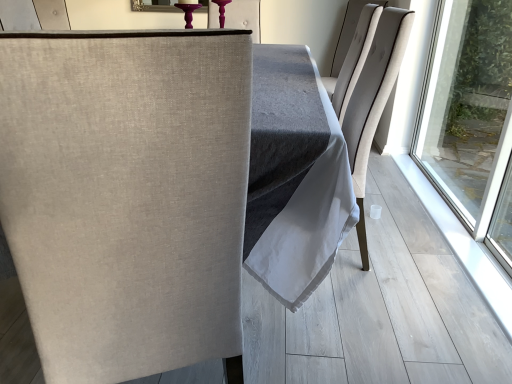
Question: Can you confirm if beige fabric chair at left, the second chair viewed from the top, is positioned to the right of light beige fabric chair at upper right, placed as the second chair when sorted from front to back?

Choices:
 (A) yes
 (B) no

Answer: (B)

Question: From a real-world perspective, is beige fabric chair at left, acting as the second chair starting from the back, beneath light beige fabric chair at upper right, the first chair positioned from the back?

Choices:
 (A) no
 (B) yes

Answer: (B)

Question: Is there a large distance between beige fabric chair at left, arranged as the first chair when ordered from the bottom, and light beige fabric chair at upper right, the first chair positioned from the back?

Choices:
 (A) yes
 (B) no

Answer: (A)

Question: Is beige fabric chair at left, positioned as the first chair in left-to-right order, closer to camera compared to light beige fabric chair at upper right, the first chair positioned from the back?

Choices:
 (A) no
 (B) yes

Answer: (B)

Question: Does beige fabric chair at left, arranged as the first chair when ordered from the bottom, have a lesser width compared to light beige fabric chair at upper right, which ranks as the second chair in left-to-right order?

Choices:
 (A) no
 (B) yes

Answer: (A)

Question: Considering the relative sizes of beige fabric chair at left, positioned as the 2th chair in right-to-left order, and light beige fabric chair at upper right, which appears as the first chair when viewed from the top, in the image provided, is beige fabric chair at left, positioned as the 2th chair in right-to-left order, taller than light beige fabric chair at upper right, which appears as the first chair when viewed from the top,?

Choices:
 (A) no
 (B) yes

Answer: (B)

Question: Can you confirm if light beige fabric chair at upper right, acting as the first chair starting from the right, is shorter than beige fabric chair at left, acting as the second chair starting from the back?

Choices:
 (A) yes
 (B) no

Answer: (A)

Question: Is light beige fabric chair at upper right, which appears as the first chair when viewed from the top, turned away from beige fabric chair at left, arranged as the first chair when ordered from the bottom?

Choices:
 (A) no
 (B) yes

Answer: (A)

Question: Can you confirm if light beige fabric chair at upper right, which appears as the first chair when viewed from the top, is taller than beige fabric chair at left, arranged as the first chair when ordered from the bottom?

Choices:
 (A) yes
 (B) no

Answer: (B)

Question: Can you confirm if light beige fabric chair at upper right, the second chair in the bottom-to-top sequence, is positioned to the right of beige fabric chair at left, the second chair viewed from the top?

Choices:
 (A) yes
 (B) no

Answer: (A)

Question: From a real-world perspective, does light beige fabric chair at upper right, which appears as the first chair when viewed from the top, stand above beige fabric chair at left, arranged as the first chair when ordered from the bottom?

Choices:
 (A) yes
 (B) no

Answer: (A)

Question: Are light beige fabric chair at upper right, the second chair in the bottom-to-top sequence, and beige fabric chair at left, positioned as the 2th chair in right-to-left order, making contact?

Choices:
 (A) no
 (B) yes

Answer: (A)

Question: Visually, is beige fabric chair at left, positioned as the 2th chair in right-to-left order, positioned to the left or to the right of light beige fabric chair at upper right, which appears as the first chair when viewed from the top?

Choices:
 (A) right
 (B) left

Answer: (B)